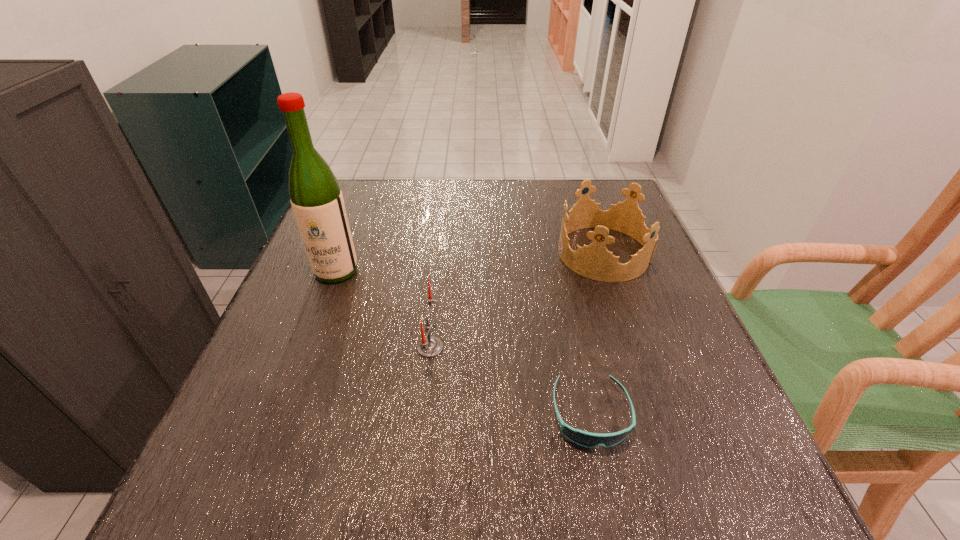
At what (x,y) coordinates should I click in order to perform the action: click on vacant space located on the front-facing side of the tiara. Please return your answer as a coordinate pair (x, y). The height and width of the screenshot is (540, 960). Looking at the image, I should click on (409, 253).

I want to click on vacant area situated 0.200m on the front-facing side of the second object from left to right, so click(x=548, y=347).

Identify the location of vacant region located on the front-facing side of the sunglasses. (610, 507).

The height and width of the screenshot is (540, 960). I want to click on object present at the left edge, so click(315, 195).

Where is `object that is at the right edge`? Image resolution: width=960 pixels, height=540 pixels. object that is at the right edge is located at coordinates (594, 261).

The height and width of the screenshot is (540, 960). In the image, there is a desktop. Find the location of `free space at the far edge`. free space at the far edge is located at coordinates (420, 181).

In the image, there is a desktop. Find the location of `vacant space at the near edge`. vacant space at the near edge is located at coordinates (524, 474).

In the image, there is a desktop. Where is `blank space at the left edge`? The image size is (960, 540). blank space at the left edge is located at coordinates (343, 298).

Locate an element on the screen. The height and width of the screenshot is (540, 960). vacant area at the right edge is located at coordinates (646, 333).

In the image, there is a desktop. Identify the location of vacant space at the far left corner. The height and width of the screenshot is (540, 960). (380, 221).